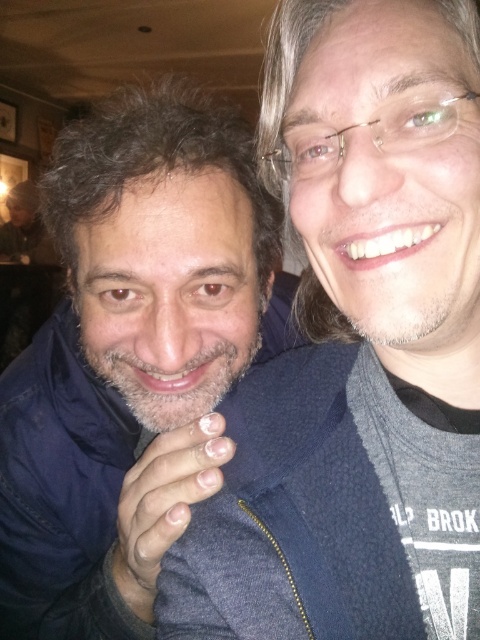
Question: Is dark blue fleece jacket at center wider than dark blue fleece jacket at left?

Choices:
 (A) no
 (B) yes

Answer: (A)

Question: Which point is farther to the camera?

Choices:
 (A) pyautogui.click(x=241, y=243)
 (B) pyautogui.click(x=312, y=49)

Answer: (A)

Question: Is dark blue fleece jacket at center above dark blue fleece jacket at left?

Choices:
 (A) yes
 (B) no

Answer: (A)

Question: Among these points, which one is nearest to the camera?

Choices:
 (A) (211, 356)
 (B) (362, 312)

Answer: (B)

Question: Is dark blue fleece jacket at center above dark blue fleece jacket at left?

Choices:
 (A) yes
 (B) no

Answer: (A)